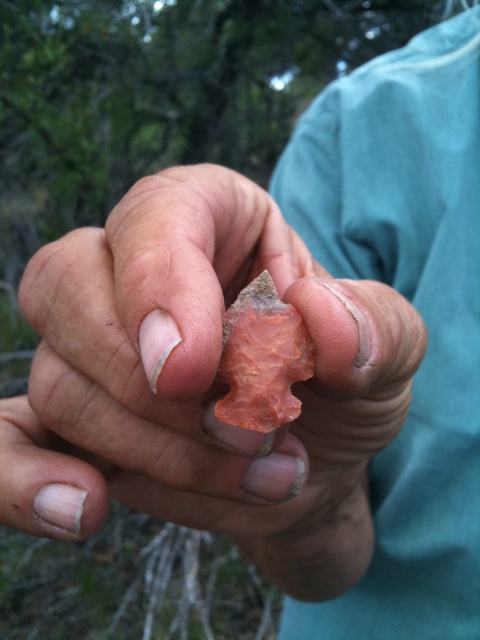
Question: Does matte orange stone arrowhead at center appear over matte orange stone at center?

Choices:
 (A) no
 (B) yes

Answer: (A)

Question: Is matte orange stone arrowhead at center positioned at the back of matte orange stone at center?

Choices:
 (A) yes
 (B) no

Answer: (B)

Question: Is matte orange stone arrowhead at center bigger than matte orange stone at center?

Choices:
 (A) no
 (B) yes

Answer: (B)

Question: Which point is farther to the camera?

Choices:
 (A) matte orange stone at center
 (B) matte orange stone arrowhead at center

Answer: (A)